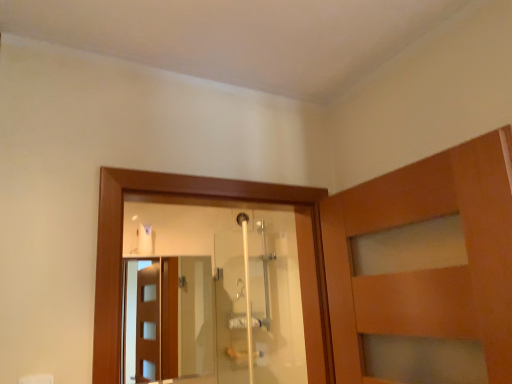
Question: Should I look upward or downward to see transparent glass screen door at center?

Choices:
 (A) down
 (B) up

Answer: (A)

Question: Does transparent glass shower door at center contain transparent glass screen door at center?

Choices:
 (A) no
 (B) yes

Answer: (A)

Question: Is transparent glass shower door at center positioned beyond the bounds of transparent glass screen door at center?

Choices:
 (A) no
 (B) yes

Answer: (B)

Question: From the image's perspective, is transparent glass shower door at center located beneath transparent glass screen door at center?

Choices:
 (A) yes
 (B) no

Answer: (B)

Question: Is transparent glass shower door at center touching transparent glass screen door at center?

Choices:
 (A) no
 (B) yes

Answer: (A)

Question: Can you confirm if transparent glass shower door at center is smaller than transparent glass screen door at center?

Choices:
 (A) yes
 (B) no

Answer: (A)

Question: Is transparent glass shower door at center aimed at transparent glass screen door at center?

Choices:
 (A) no
 (B) yes

Answer: (B)

Question: Is transparent glass screen door at center positioned beyond the bounds of transparent glass shower door at center?

Choices:
 (A) yes
 (B) no

Answer: (A)

Question: Can you confirm if transparent glass screen door at center is thinner than transparent glass shower door at center?

Choices:
 (A) yes
 (B) no

Answer: (B)

Question: From a real-world perspective, is transparent glass screen door at center on top of transparent glass shower door at center?

Choices:
 (A) yes
 (B) no

Answer: (B)

Question: Can you confirm if transparent glass screen door at center is bigger than transparent glass shower door at center?

Choices:
 (A) no
 (B) yes

Answer: (B)

Question: Is transparent glass screen door at center positioned with its back to transparent glass shower door at center?

Choices:
 (A) no
 (B) yes

Answer: (A)

Question: Is transparent glass screen door at center wider than transparent glass shower door at center?

Choices:
 (A) yes
 (B) no

Answer: (A)

Question: In terms of height, does transparent glass shower door at center look taller or shorter compared to transparent glass screen door at center?

Choices:
 (A) short
 (B) tall

Answer: (B)